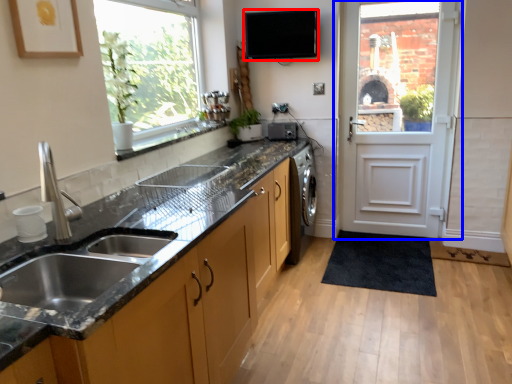
Question: Which object appears closest to the camera in this image, appliance (highlighted by a red box) or door (highlighted by a blue box)?

Choices:
 (A) appliance
 (B) door

Answer: (B)